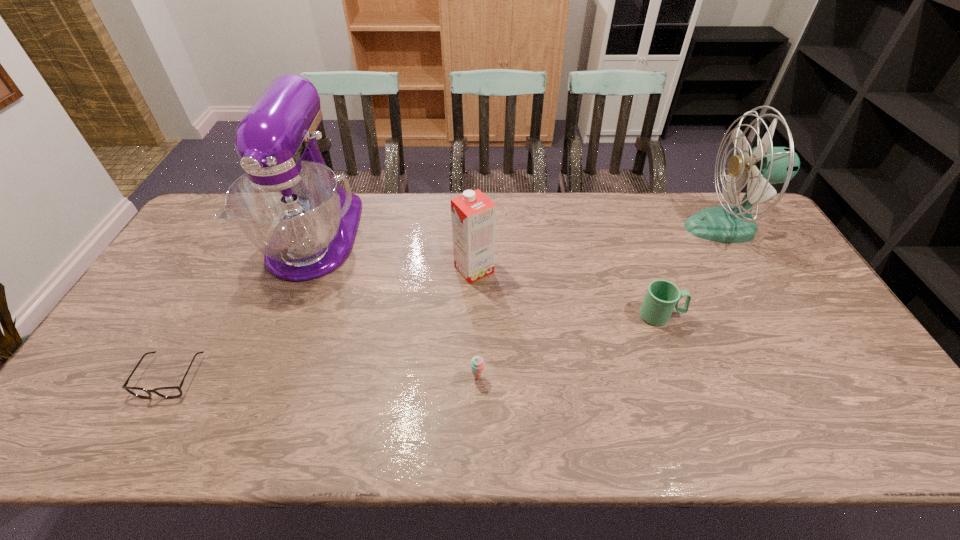
Locate an element on the screen. This screenshot has width=960, height=540. vacant region between the fan and the carton is located at coordinates (599, 248).

You are a GUI agent. You are given a task and a screenshot of the screen. Output one action in this format:
    pyautogui.click(x=<x>, y=<y>)
    Task: Click on the free space between the carton and the spectacles
    Image resolution: width=960 pixels, height=540 pixels.
    Given the screenshot: What is the action you would take?
    pyautogui.click(x=323, y=323)

The width and height of the screenshot is (960, 540). I want to click on free space between the sherbert and the second object from right to left, so click(x=569, y=346).

At what (x,y) coordinates should I click in order to perform the action: click on object that can be found as the third closest to the fifth object from right to left. Please return your answer as a coordinate pair (x, y). This screenshot has height=540, width=960. Looking at the image, I should click on (477, 363).

Locate an element on the screen. This screenshot has height=540, width=960. object that is the third closest to the spectacles is located at coordinates (477, 363).

Locate an element on the screen. Image resolution: width=960 pixels, height=540 pixels. free space that satisfies the following two spatial constraints: 1. on the front-facing side of the sherbert; 2. on the right side of the leftmost object is located at coordinates (170, 377).

Identify the location of free space that satisfies the following two spatial constraints: 1. on the side of the fifth object from left to right with the handle; 2. on the front-facing side of the spectacles. Image resolution: width=960 pixels, height=540 pixels. (684, 376).

I want to click on free region that satisfies the following two spatial constraints: 1. on the front-facing side of the sherbert; 2. on the left side of the shortest object, so click(x=170, y=377).

In order to click on free region that satisfies the following two spatial constraints: 1. on the side of the fourth farthest object with the handle; 2. on the front-facing side of the spectacles in this screenshot , I will do `click(684, 376)`.

The height and width of the screenshot is (540, 960). Identify the location of free spot that satisfies the following two spatial constraints: 1. on the front side of the sherbert; 2. on the right side of the fourth shortest object. (472, 377).